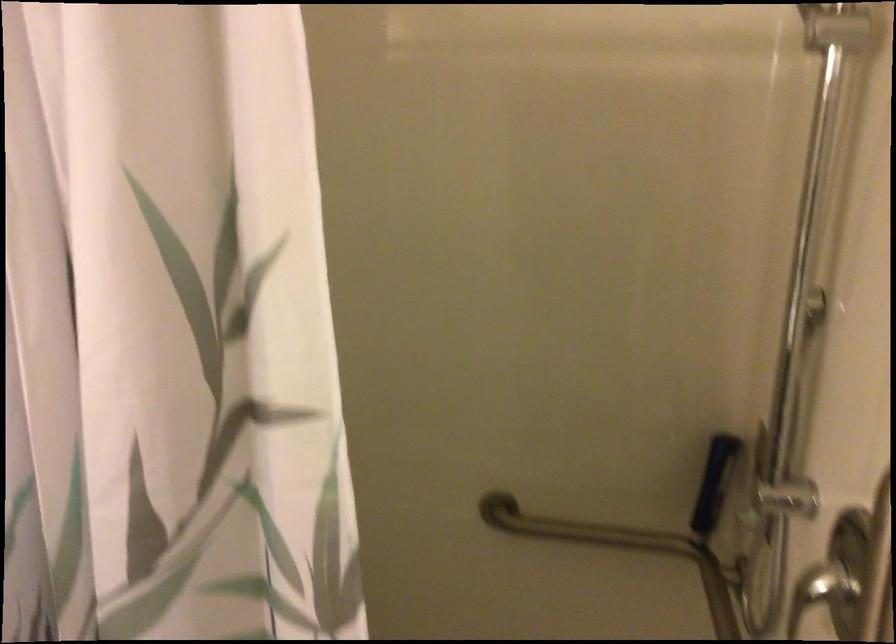
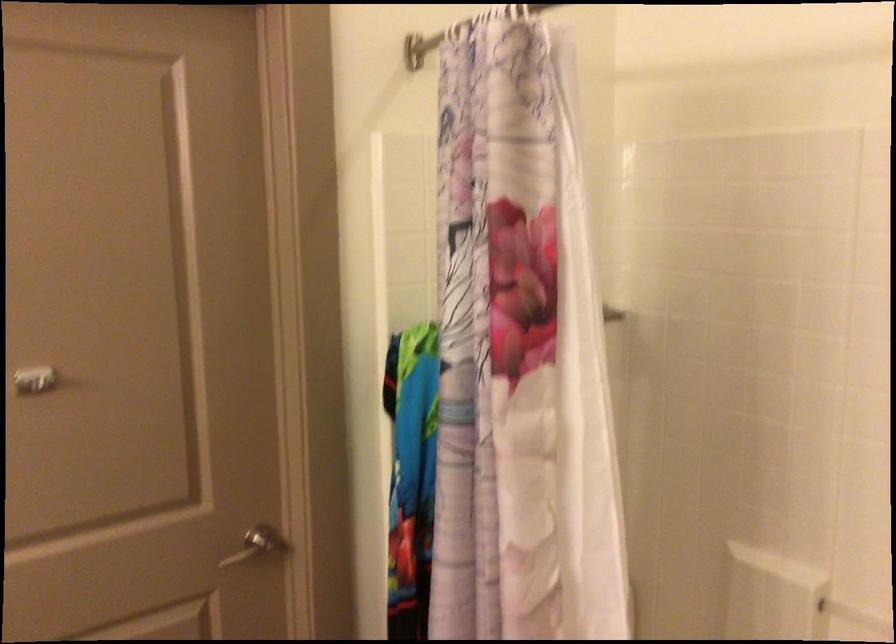
Question: How did the camera likely rotate?

Choices:
 (A) Left
 (B) Right
 (C) Up
 (D) Down

Answer: (A)